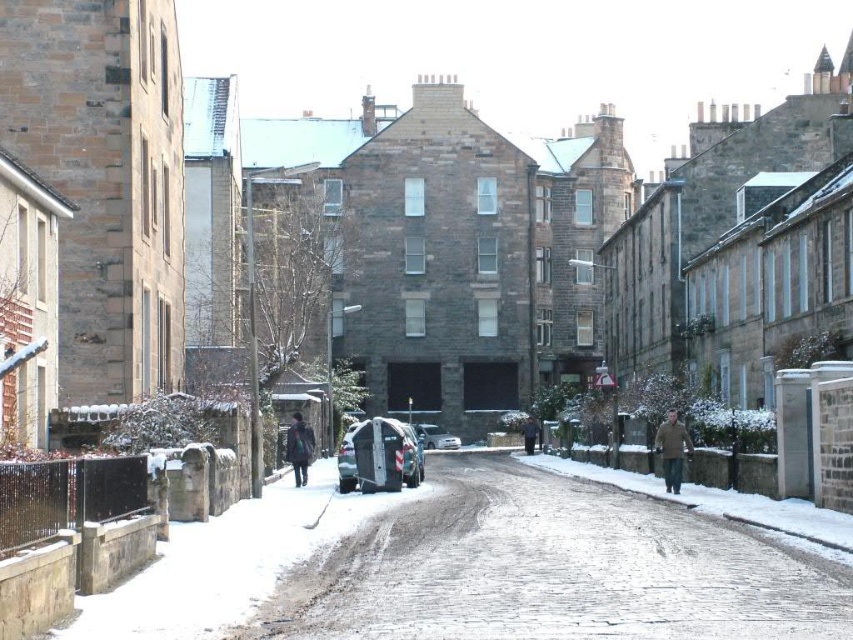
Question: Can you confirm if snowy cobblestone road at center is thinner than dark brown leather jacket at center?

Choices:
 (A) no
 (B) yes

Answer: (A)

Question: Can you confirm if snowy cobblestone road at center is wider than metallic silver car at center?

Choices:
 (A) yes
 (B) no

Answer: (A)

Question: Can you confirm if snowy cobblestone road at center is positioned to the right of metallic silver car at center?

Choices:
 (A) no
 (B) yes

Answer: (B)

Question: Which point is closer to the camera?

Choices:
 (A) brown wool coat at center
 (B) metallic silver car at center

Answer: (B)

Question: Which of these objects is positioned farthest from the dark brown leather jacket at center?

Choices:
 (A) brown woolen coat at center
 (B) snowy cobblestone road at center

Answer: (A)

Question: Among these points, which one is nearest to the camera?

Choices:
 (A) (665, 451)
 (B) (447, 435)
 (C) (405, 483)

Answer: (A)